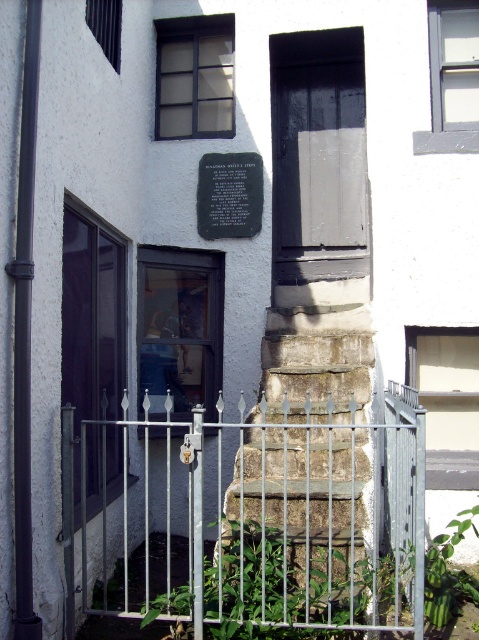
Question: Which point is farther to the camera?

Choices:
 (A) matte glass door at left
 (B) metallic silver gate at center
 (C) matte black door at center
 (D) green leafy plant at lower center

Answer: (C)

Question: Can you confirm if matte glass door at left is positioned to the left of transparent glass door at center?

Choices:
 (A) no
 (B) yes

Answer: (B)

Question: Estimate the real-world distances between objects in this image. Which object is farther from the matte glass door at left?

Choices:
 (A) stone textured stairs at center
 (B) black stone plaque at center
 (C) matte black door at center
 (D) transparent glass door at center

Answer: (C)

Question: Is matte black door at center wider than matte glass door at left?

Choices:
 (A) yes
 (B) no

Answer: (A)

Question: Among these objects, which one is farthest from the camera?

Choices:
 (A) stone textured stairs at center
 (B) green leafy plant at lower center
 (C) black stone plaque at center
 (D) matte glass door at left

Answer: (C)

Question: Can you confirm if matte black door at center is bigger than matte glass door at left?

Choices:
 (A) no
 (B) yes

Answer: (B)